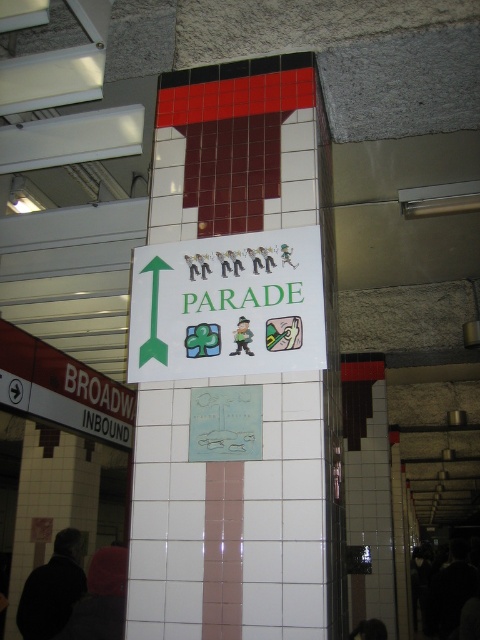
Who is lower down, white paper sign at center or green paper sign at upper center?

white paper sign at center

Locate an element on the screen. This screenshot has height=640, width=480. white paper sign at center is located at coordinates [227, 307].

Can you confirm if white tile pillar at center is positioned below white plastic text at left?

Correct, white tile pillar at center is located below white plastic text at left.

Does point (326, 596) come behind point (97, 376)?

No, (326, 596) is closer to viewer.

Locate an element on the screen. The height and width of the screenshot is (640, 480). white tile pillar at center is located at coordinates click(x=256, y=380).

Does white plastic text at left have a greater height compared to black plastic text at lower left?

Indeed, white plastic text at left has a greater height compared to black plastic text at lower left.

What do you see at coordinates (98, 392) in the screenshot?
I see `white plastic text at left` at bounding box center [98, 392].

Where is `white plastic text at left`? white plastic text at left is located at coordinates (98, 392).